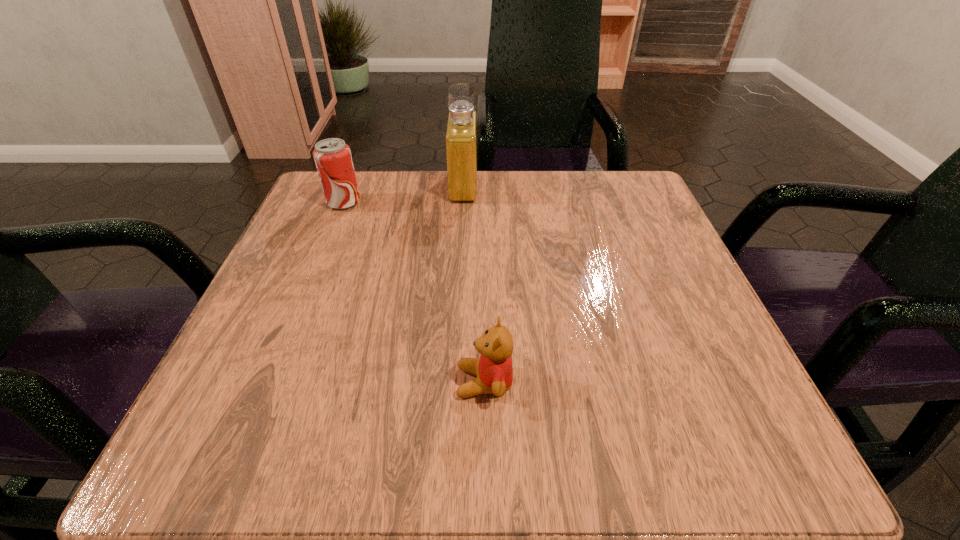
Identify the location of free spot at the near left corner of the desktop. (282, 411).

Where is `free space at the far right corner`? free space at the far right corner is located at coordinates (625, 195).

This screenshot has width=960, height=540. What are the coordinates of `free space at the near right corner of the desktop` in the screenshot? It's located at (694, 463).

This screenshot has height=540, width=960. What are the coordinates of `free point between the shortest object and the perfume` in the screenshot? It's located at (474, 284).

Locate an element on the screen. The width and height of the screenshot is (960, 540). vacant area that lies between the teddy bear and the perfume is located at coordinates (x=474, y=284).

Where is `free spot between the leftmost object and the perfume`? free spot between the leftmost object and the perfume is located at coordinates (404, 194).

Identify the location of vacant area that lies between the soda can and the nearest object. [414, 292].

The width and height of the screenshot is (960, 540). What are the coordinates of `empty space that is in between the second tallest object and the nearest object` in the screenshot? It's located at (414, 292).

Identify the location of free area in between the tallest object and the shortest object. Image resolution: width=960 pixels, height=540 pixels. (474, 284).

What are the coordinates of `free spot between the soda can and the tallest object` in the screenshot? It's located at (404, 194).